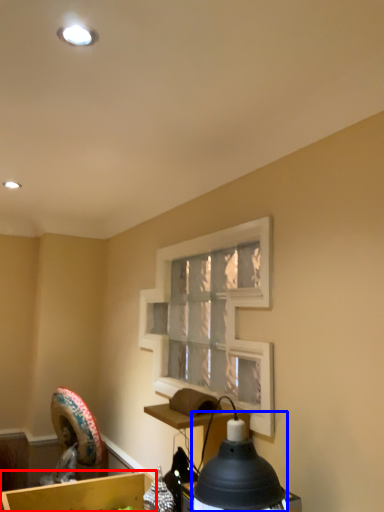
Question: Which point is further to the camera, cardboard box (highlighted by a red box) or lamp (highlighted by a blue box)?

Choices:
 (A) cardboard box
 (B) lamp

Answer: (A)